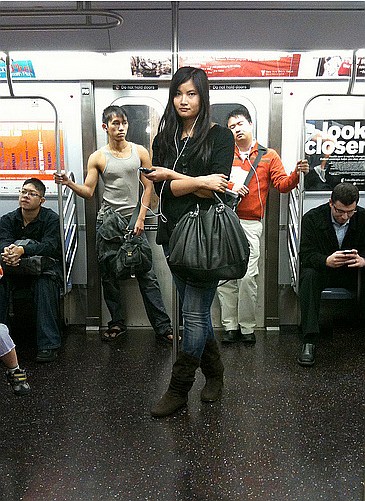
You are a GUI agent. You are given a task and a screenshot of the screen. Output one action in this format:
    pyautogui.click(x=<x>, y=<y>)
    Task: Click on the floor
    This screenshot has height=501, width=365.
    Given the screenshot: What is the action you would take?
    pyautogui.click(x=253, y=449)